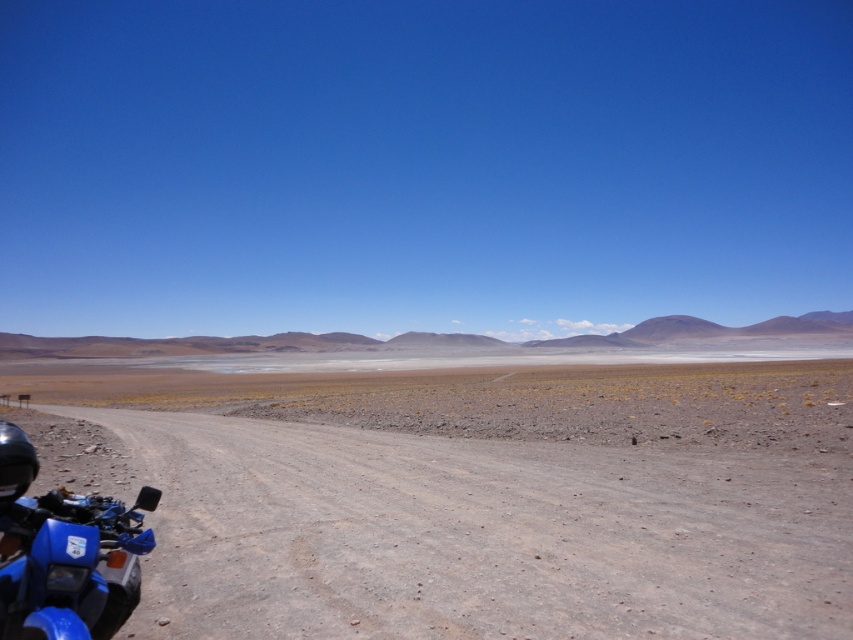
Find the location of `blue gravel road at lower left`. blue gravel road at lower left is located at coordinates (479, 534).

Between blue gravel road at lower left and blue matte motorcycle at lower left, which one is positioned lower?

Positioned lower is blue gravel road at lower left.

This screenshot has height=640, width=853. What do you see at coordinates (479, 534) in the screenshot?
I see `blue gravel road at lower left` at bounding box center [479, 534].

The image size is (853, 640). I want to click on blue gravel road at lower left, so click(x=479, y=534).